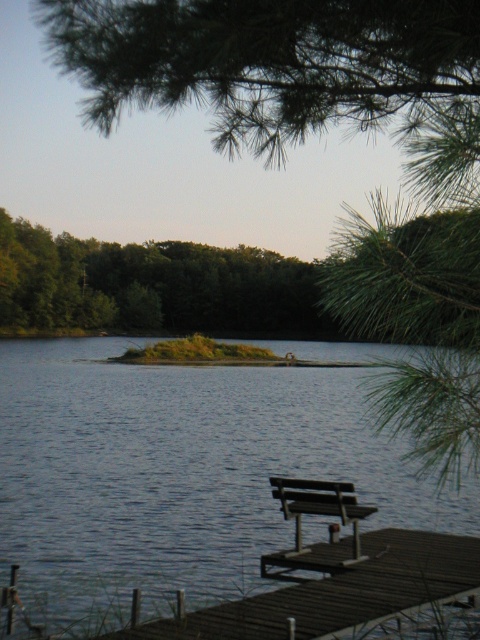
Question: Estimate the real-world distances between objects in this image. Which object is farther from the dark blue water at center?

Choices:
 (A) green needle-like leaves at upper center
 (B) dark brown wood dock at lower right

Answer: (B)

Question: Does green needle-like leaves at upper center lie behind dark brown wood dock at lower right?

Choices:
 (A) no
 (B) yes

Answer: (A)

Question: Which point is farther to the camera?

Choices:
 (A) dark blue water at center
 (B) green leafy tree at center
 (C) dark brown wood dock at lower right
 (D) wooden bench at lower right

Answer: (B)

Question: Can you confirm if green needle-like leaves at upper center is smaller than dark brown wood dock at lower right?

Choices:
 (A) no
 (B) yes

Answer: (A)

Question: Is green needle-like leaves at upper center to the right of wooden bench at lower right from the viewer's perspective?

Choices:
 (A) yes
 (B) no

Answer: (A)

Question: Considering the real-world distances, which object is closest to the green leafy tree at center?

Choices:
 (A) dark blue water at center
 (B) green needle-like leaves at upper center
 (C) wooden bench at lower right

Answer: (A)